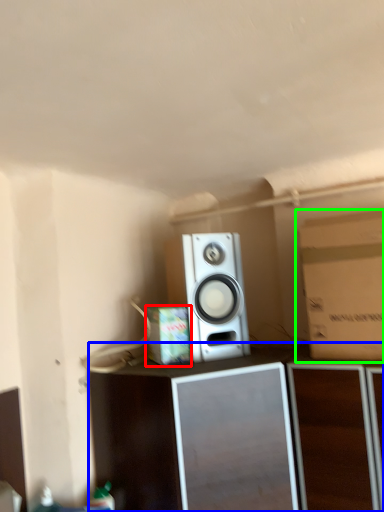
Question: Based on their relative distances, which object is farther from cardboard box (highlighted by a red box)? Choose from furniture (highlighted by a blue box) and cardboard box (highlighted by a green box).

Choices:
 (A) furniture
 (B) cardboard box

Answer: (B)